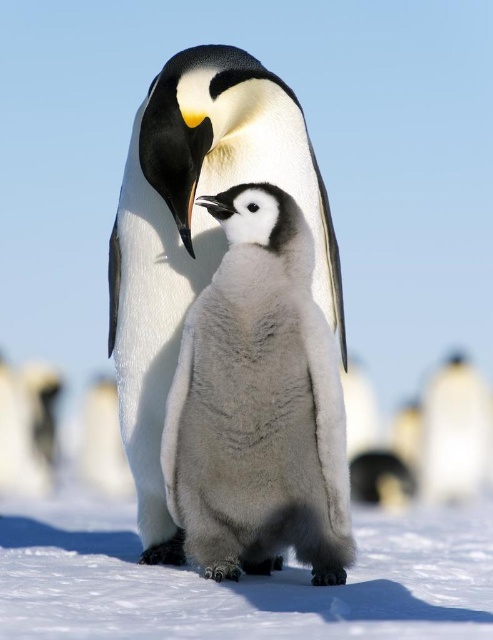
Does white fluffy penguin at center have a smaller size compared to white fluffy penguin at lower right?

Yes, white fluffy penguin at center is smaller than white fluffy penguin at lower right.

Looking at this image, which is above, white fluffy penguin at center or white fluffy penguin at lower right?

Positioned higher is white fluffy penguin at center.

At what (x,y) coordinates should I click in order to perform the action: click on white fluffy penguin at center. Please return your answer as a coordinate pair (x, y). The image size is (493, 640). Looking at the image, I should click on (196, 227).

Where is `white fluffy penguin at center`? Image resolution: width=493 pixels, height=640 pixels. white fluffy penguin at center is located at coordinates (196, 227).

Is point (430, 620) more distant than point (453, 406)?

That is False.

Is point (280, 593) in front of point (490, 444)?

Yes.

Who is more distant from viewer, (367, 576) or (460, 440)?

The point (460, 440) is behind.

In order to click on white fluffy snow at lower center in this screenshot , I will do click(245, 582).

Which of these two, white fluffy snow at lower center or white fluffy penguin at center, stands taller?

white fluffy penguin at center is taller.

Who is more distant from viewer, (180, 570) or (191, 164)?

Point (180, 570)

Find the location of `white fluffy snow at lower center`. white fluffy snow at lower center is located at coordinates click(245, 582).